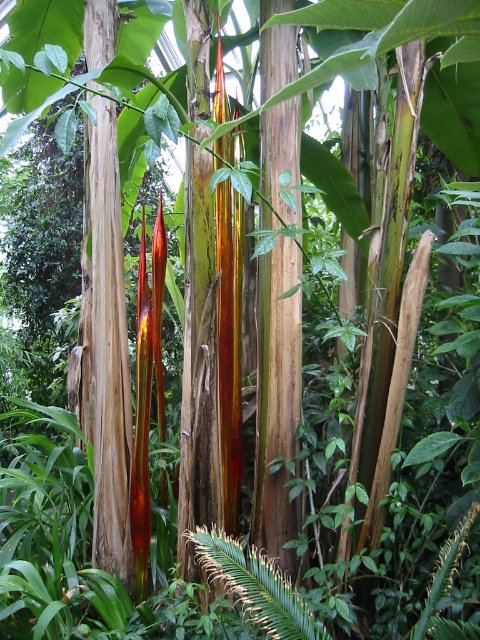
You are a gardener who wants to water the green leafy fern at center. The smooth brown tree trunk at center is blocking your path. Can you move around the trunk to reach the fern?

The smooth brown tree trunk at center is positioned over green leafy fern at center, meaning the trunk is directly above the fern. Since the trunk is blocking the path, you cannot physically move around it to reach the fern. You might need to find an alternative method, such as using a long watering can or adjusting the angle of the hose to water the fern without needing to physically access it directly.